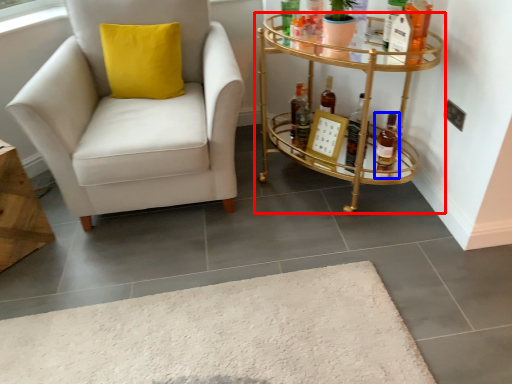
Question: Which object is closer to the camera taking this photo, table (highlighted by a red box) or bottle (highlighted by a blue box)?

Choices:
 (A) table
 (B) bottle

Answer: (A)